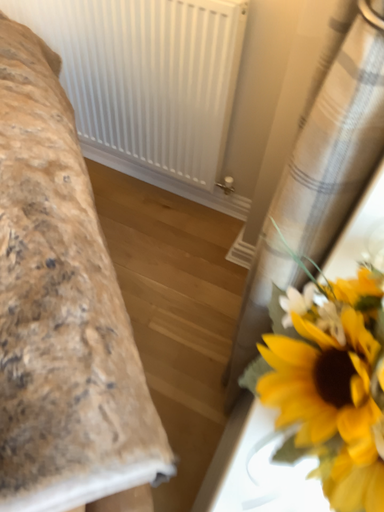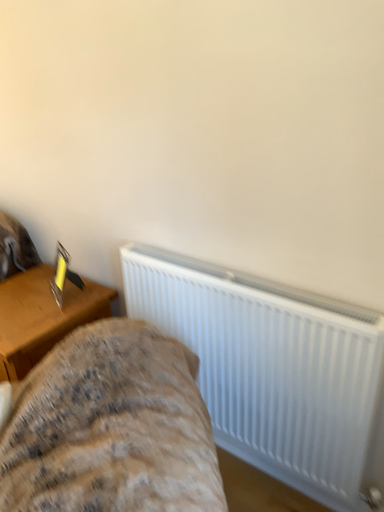
Question: Which way did the camera rotate in the video?

Choices:
 (A) rotated downward
 (B) rotated upward

Answer: (B)